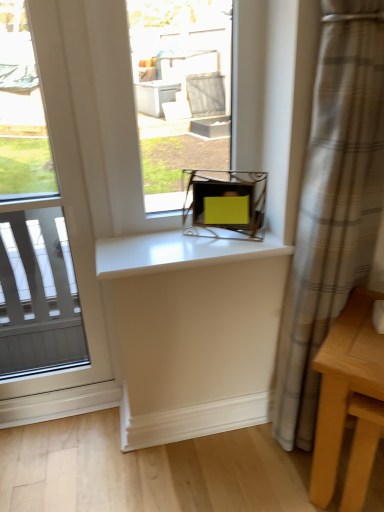
Where is `free space in front of yellow matte box at center`? free space in front of yellow matte box at center is located at coordinates click(216, 244).